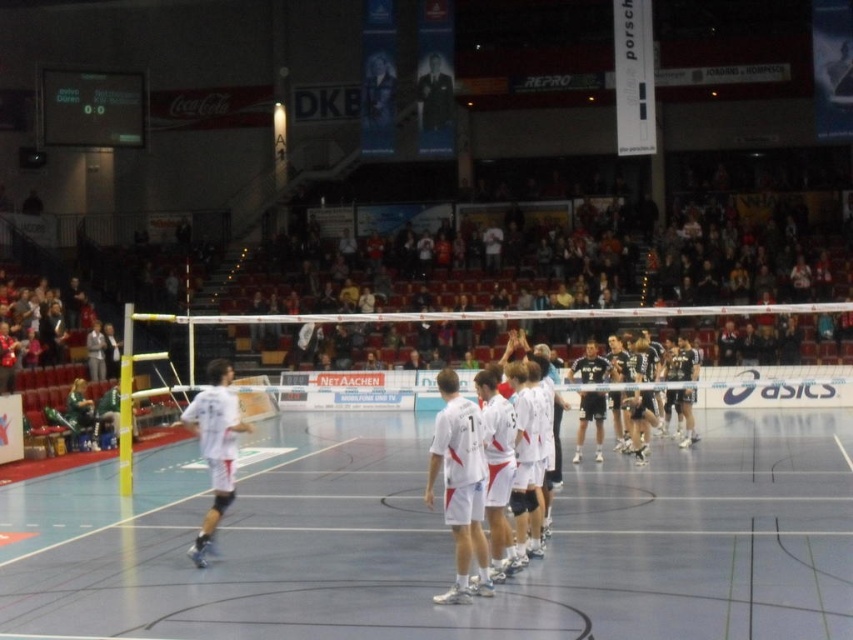
Question: From the image, what is the correct spatial relationship of white/red jersey at center in relation to white matte jersey at left?

Choices:
 (A) left
 (B) right

Answer: (B)

Question: Where is white synthetic court at center located in relation to white/red jersey at center in the image?

Choices:
 (A) right
 (B) left

Answer: (A)

Question: Which object appears farthest from the camera in this image?

Choices:
 (A) white synthetic court at center
 (B) white/red jersey at center
 (C) white matte jersey at left

Answer: (C)

Question: Estimate the real-world distances between objects in this image. Which object is farther from the white/red jersey at center?

Choices:
 (A) white matte jersey at left
 (B) white synthetic court at center

Answer: (A)

Question: Is white synthetic court at center to the right of white/red jersey at center from the viewer's perspective?

Choices:
 (A) no
 (B) yes

Answer: (B)

Question: Which point is farther to the camera?

Choices:
 (A) white/red jersey at center
 (B) white matte jersey at left

Answer: (B)